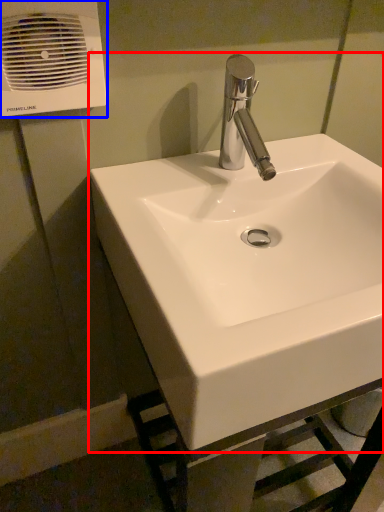
Question: Which object appears closest to the camera in this image, sink (highlighted by a red box) or air conditioning (highlighted by a blue box)?

Choices:
 (A) sink
 (B) air conditioning

Answer: (A)